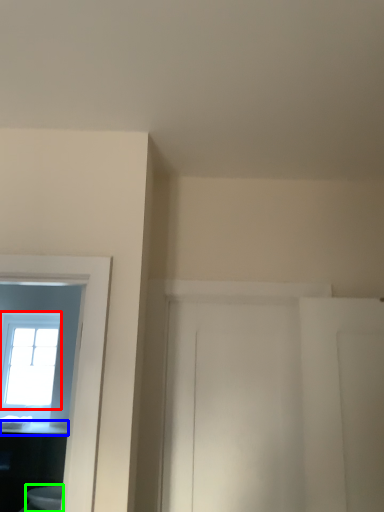
Question: Considering the real-world distances, which object is farthest from window (highlighted by a red box)? counter top (highlighted by a blue box) or toilet (highlighted by a green box)?

Choices:
 (A) counter top
 (B) toilet

Answer: (B)